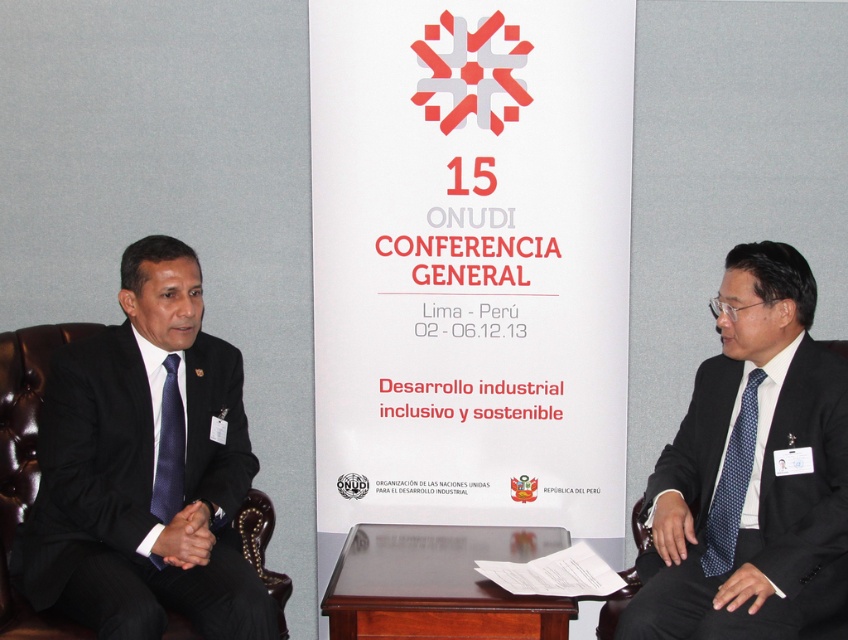
You are a photographer taking a picture of the black pinstripe suit at left and the blue dotted tie at right. Can you focus on both subjects equally in one shot?

The black pinstripe suit at left is in front of the blue dotted tie at right, so focusing on both equally may be challenging as the blue dotted tie at right is further back.

You are standing in front of the image and want to know how far the point at coordinates (51, 419) is from you. Can you determine the distance?

The point at coordinates (51, 419) is 7.28 feet away from the viewer.

Based on the coordinates provided, which object is located at point (146, 467)?

The black pinstripe suit at left is located at point (146, 467).